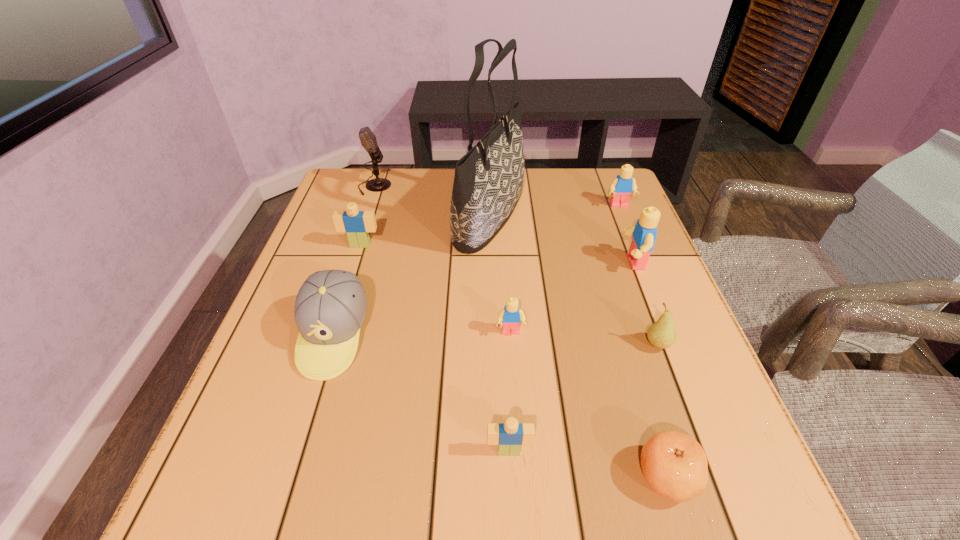
Image resolution: width=960 pixels, height=540 pixels. I want to click on vacant space in between the smaller beige Lego and the pear, so click(583, 397).

Where is `free spot between the pear and the tallest object`? This screenshot has width=960, height=540. free spot between the pear and the tallest object is located at coordinates (573, 281).

The height and width of the screenshot is (540, 960). What are the coordinates of `vacant area that lies between the nearest Lego and the shortest object` in the screenshot? It's located at (588, 463).

In order to click on free space between the black tote bag and the clementine in this screenshot , I will do `click(579, 347)`.

You are a GUI agent. You are given a task and a screenshot of the screen. Output one action in this format:
    pyautogui.click(x=<x>, y=<y>)
    Task: Click on the free space between the smallest yellow Lego and the baseball cap
    
    Given the screenshot: What is the action you would take?
    pyautogui.click(x=422, y=334)

Point out which object is positioned as the second nearest to the microphone. Please provide its 2D coordinates. Your answer should be formatted as a tuple, i.e. [(x, y)], where the tuple contains the x and y coordinates of a point satisfying the conditions above.

[(356, 224)]

Identify the location of object that ranks as the seventh closest to the biggest yellow Lego. Image resolution: width=960 pixels, height=540 pixels. (330, 308).

Locate an element on the screen. the second closest Lego to the eighth shortest object is located at coordinates (511, 316).

Identify which Lego is located as the nearest to the baseball cap. Please provide its 2D coordinates. Your answer should be formatted as a tuple, i.e. [(x, y)], where the tuple contains the x and y coordinates of a point satisfying the conditions above.

[(356, 224)]

This screenshot has width=960, height=540. I want to click on the closest yellow Lego relative to the second nearest Lego, so click(x=644, y=233).